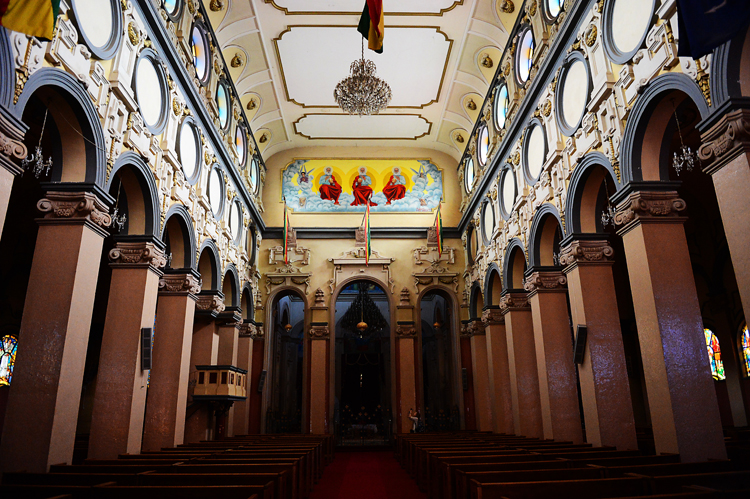
Locate an element on the screen. This screenshot has width=750, height=499. stained glass windows is located at coordinates (x=710, y=352), (x=747, y=343).